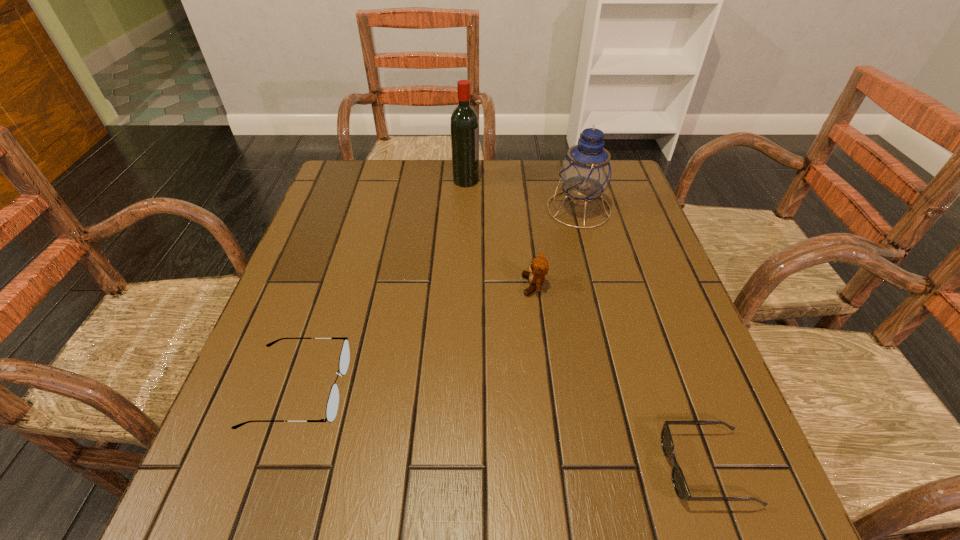
Where is `free space at the left edge`? The width and height of the screenshot is (960, 540). free space at the left edge is located at coordinates (254, 427).

In the image, there is a desktop. Find the location of `vacant space at the right edge`. vacant space at the right edge is located at coordinates (663, 262).

Where is `vacant space at the far left corner of the desktop`? The image size is (960, 540). vacant space at the far left corner of the desktop is located at coordinates (366, 176).

The image size is (960, 540). I want to click on free point at the near left corner, so click(256, 470).

Locate an element on the screen. vacant area at the near right corner of the desktop is located at coordinates (757, 514).

This screenshot has width=960, height=540. In order to click on free space between the farthest object and the third farthest object in this screenshot , I will do `click(500, 233)`.

I want to click on free spot between the fourth tallest object and the fourth nearest object, so click(x=439, y=299).

Locate an element on the screen. The width and height of the screenshot is (960, 540). free spot between the third farthest object and the spectacles is located at coordinates (417, 337).

Identify the location of free point between the spectacles and the third shortest object. (417, 337).

In order to click on free space that is in between the sunglasses and the second tallest object in this screenshot , I will do `click(643, 339)`.